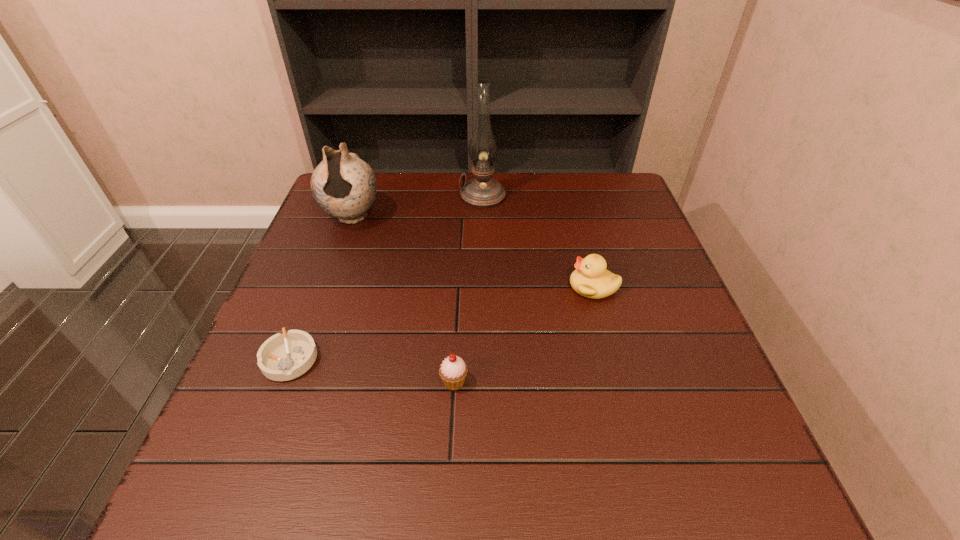
At what (x,y) coordinates should I click in order to perform the action: click on free space located 0.180m on the front-facing side of the third nearest object. Please return your answer as a coordinate pair (x, y). Looking at the image, I should click on (494, 286).

Find the location of a particular element. vacant space located on the right of the cupcake is located at coordinates (561, 381).

Identify the location of vacant space located 0.200m on the front of the ashtray. The width and height of the screenshot is (960, 540). (240, 489).

Where is `oil lamp at the far edge`? The image size is (960, 540). oil lamp at the far edge is located at coordinates (482, 191).

The image size is (960, 540). What are the coordinates of `pottery at the far edge` in the screenshot? It's located at (343, 185).

Identify the location of pottery that is positioned at the left edge. (343, 185).

Locate an element on the screen. ashtray present at the left edge is located at coordinates (282, 357).

Locate an element on the screen. This screenshot has height=540, width=960. object present at the right edge is located at coordinates (590, 279).

Where is `object that is at the far left corner`? object that is at the far left corner is located at coordinates (343, 185).

At what (x,y) coordinates should I click in order to perform the action: click on free space at the far edge of the desktop. Please return your answer as a coordinate pair (x, y). This screenshot has width=960, height=540. Looking at the image, I should click on (559, 212).